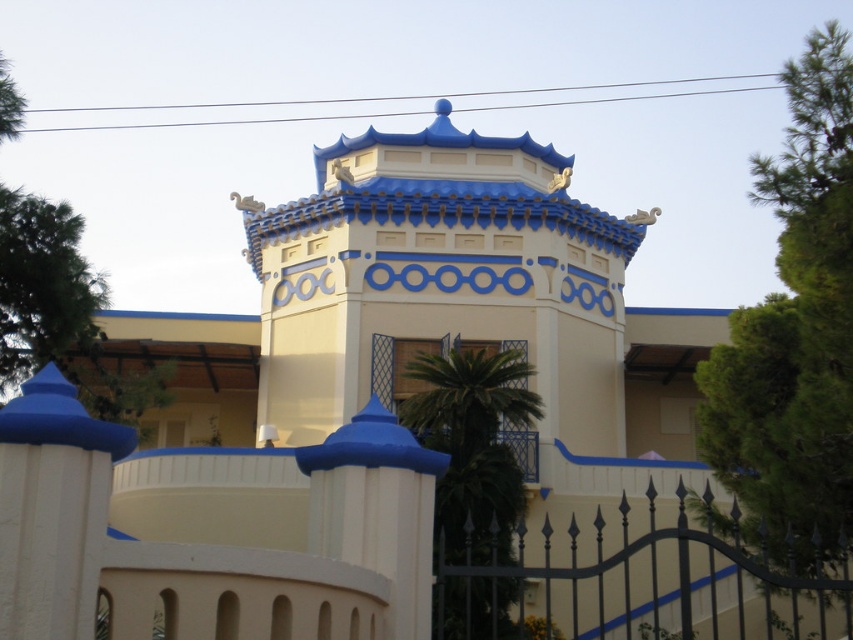
Between black wrought iron fence at lower right and green leafy palm tree at center, which one appears on the right side from the viewer's perspective?

From the viewer's perspective, black wrought iron fence at lower right appears more on the right side.

Which is above, black wrought iron fence at lower right or green leafy palm tree at center?

green leafy palm tree at center is higher up.

Does point (666, 634) come closer to viewer compared to point (448, 406)?

No, it is behind (448, 406).

Find the location of a particular element. The height and width of the screenshot is (640, 853). black wrought iron fence at lower right is located at coordinates (640, 576).